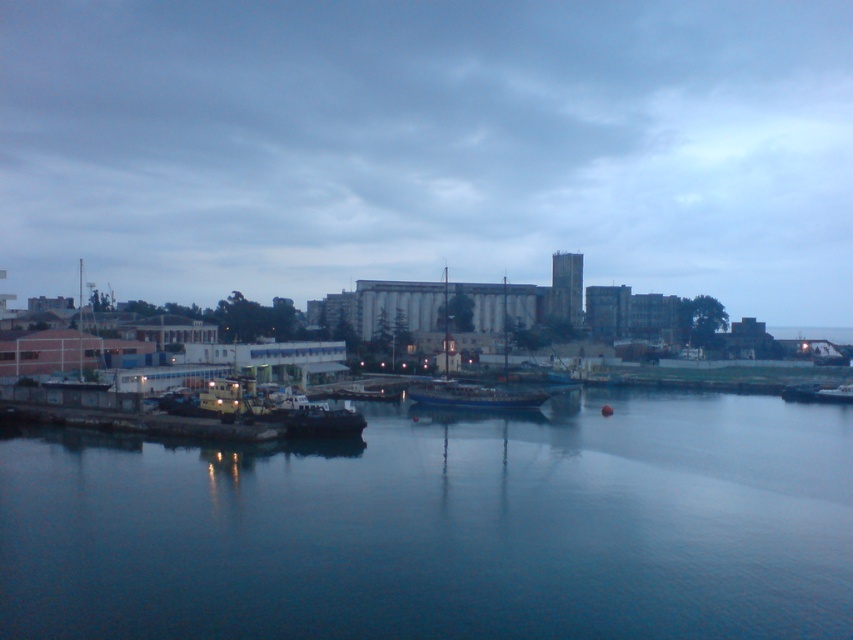
You are standing on the pier and looking at the blue smooth water at center and the dark gray metallic boat at center. Which object is located lower in the scene?

The blue smooth water at center is located below the dark gray metallic boat at center, so the blue smooth water at center is lower in the scene.

You are standing on the pier and see the blue smooth water at center and the blue metallic boat at center. Which object is located below the other?

The blue smooth water at center is positioned under the blue metallic boat at center, so the water is below the boat.